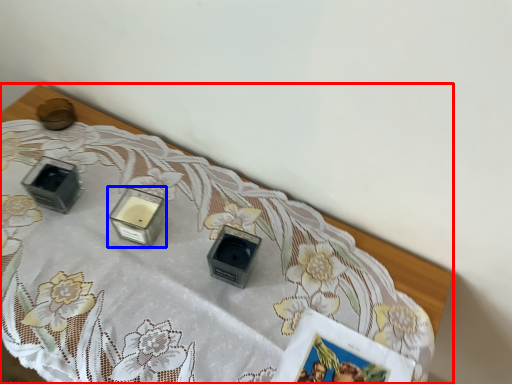
Question: Which object is closer to the camera taking this photo, table (highlighted by a red box) or candle holder (highlighted by a blue box)?

Choices:
 (A) table
 (B) candle holder

Answer: (A)